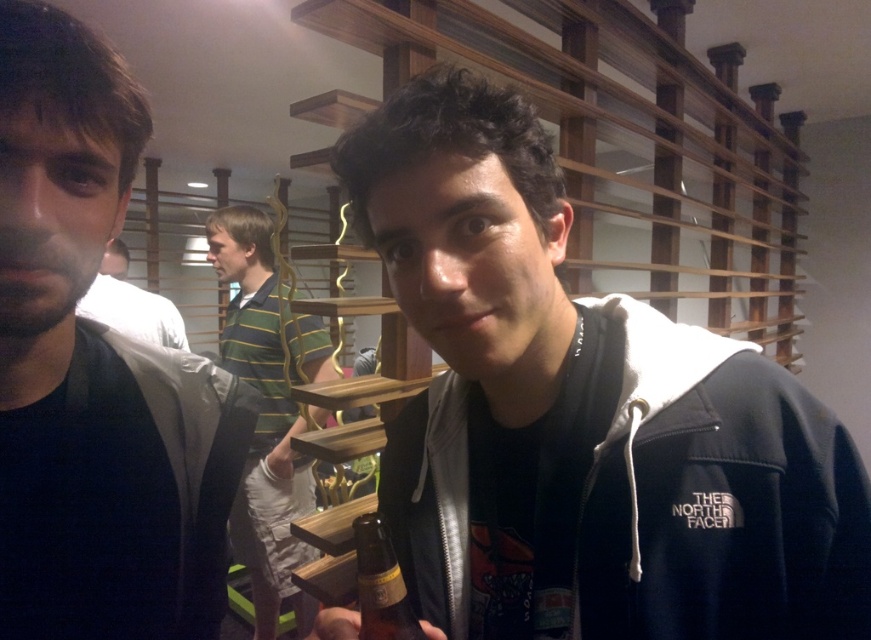
Measure the distance from brown glass bottle at center to white matte shirt at center.

A distance of 2.28 meters exists between brown glass bottle at center and white matte shirt at center.

In order to click on brown glass bottle at center in this screenshot , I will do `click(381, 584)`.

Find the location of a particular element. The width and height of the screenshot is (871, 640). brown glass bottle at center is located at coordinates (381, 584).

Who is taller, black matte hoodie at center or green striped shirt at center?

Standing taller between the two is green striped shirt at center.

Is point (581, 570) positioned behind point (262, 538)?

No, it is not.

The width and height of the screenshot is (871, 640). Find the location of `black matte hoodie at center`. black matte hoodie at center is located at coordinates (582, 416).

Can you confirm if black matte hoodie at center is positioned below dark brown hair at left?

Yes.

Can you confirm if black matte hoodie at center is thinner than dark brown hair at left?

Incorrect, black matte hoodie at center's width is not less than dark brown hair at left's.

Between point (466, 272) and point (89, 125), which one is positioned in front?

Point (466, 272) is in front.

The width and height of the screenshot is (871, 640). I want to click on black matte hoodie at center, so click(x=582, y=416).